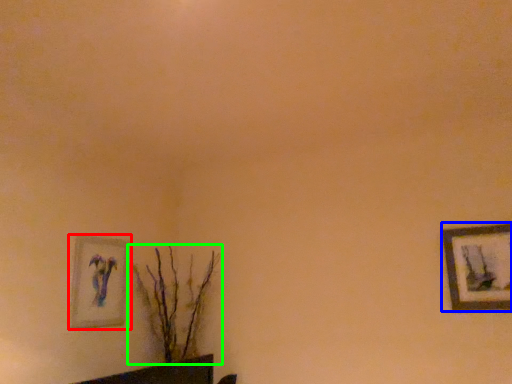
Question: Which object is positioned farthest from picture frame (highlighted by a red box)? Select from picture frame (highlighted by a blue box) and houseplant (highlighted by a green box).

Choices:
 (A) picture frame
 (B) houseplant

Answer: (A)